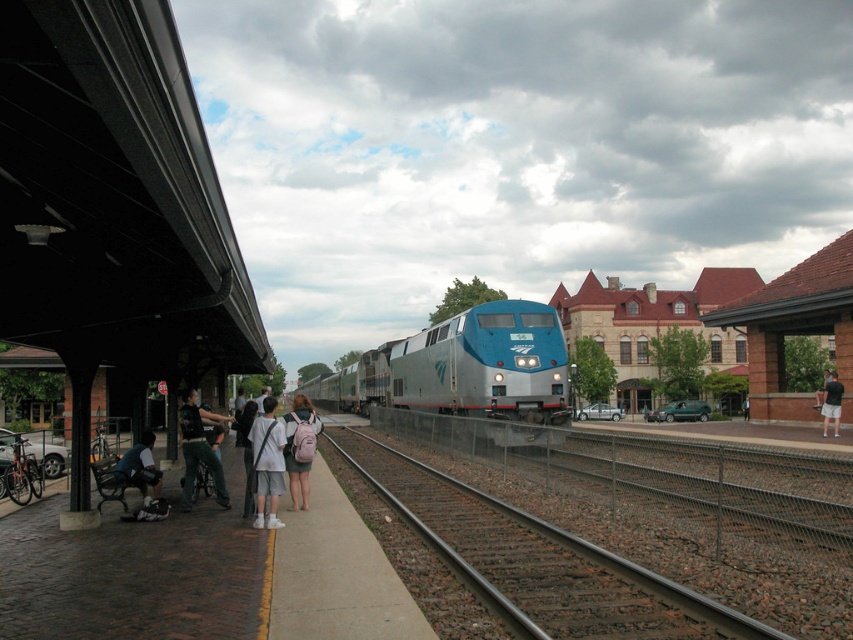
You are standing on the train station platform and want to take a photo of both point [544,435] and point [254,516] in the scene. Which point should you focus on first to ensure both are in focus?

You should focus on point [544,435] first because it is closer to the camera than point [254,516], ensuring both will be in focus.

You are standing at the train station platform and notice a person wearing light gray fabric shorts at center. Based on their position, can you estimate where they are located relative to the platform edge?

The light gray fabric shorts at center is located at point [267,464], which is closer to the platform edge than the center of the platform. Therefore, the person is near the edge of the platform.